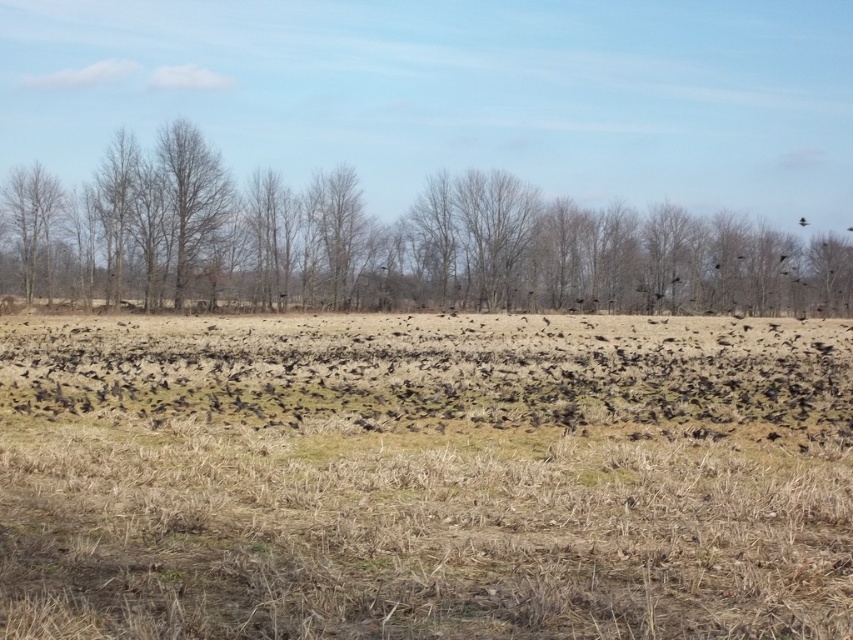
Question: Among these points, which one is nearest to the camera?

Choices:
 (A) (648, 266)
 (B) (163, 161)
 (C) (22, 228)
 (D) (85, 355)

Answer: (D)

Question: Which object is positioned closest to the black matte birds at center?

Choices:
 (A) bare wood tree at center
 (B) black matte bird at upper right
 (C) bare branches at center
 (D) bare wood tree at left

Answer: (C)

Question: Is black matte birds at center to the left of bare wood tree at left from the viewer's perspective?

Choices:
 (A) no
 (B) yes

Answer: (A)

Question: Is bare wood tree at center closer to camera compared to black matte bird at upper right?

Choices:
 (A) no
 (B) yes

Answer: (B)

Question: Is black matte birds at center to the right of black matte bird at upper right from the viewer's perspective?

Choices:
 (A) yes
 (B) no

Answer: (B)

Question: Which of the following is the farthest from the observer?

Choices:
 (A) (195, 148)
 (B) (798, 218)

Answer: (B)